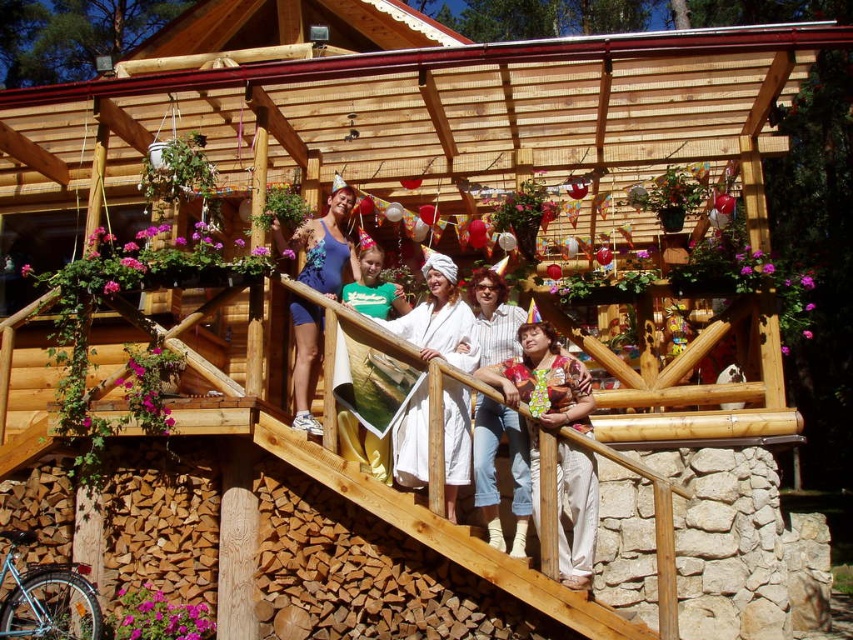
You are planning to hang a picture frame between the white cotton bathrobe at center and the blue fabric swimsuit at upper center. Which object should the frame be placed closer to if you want it to be at the same height as the taller object?

The blue fabric swimsuit at upper center is taller than the white cotton bathrobe at center. Therefore, to place the picture frame at the same height as the taller object, it should be positioned closer to the blue fabric swimsuit at upper center.

In the scene of a rustic cabin deck with people celebrating, there are two individuals wearing a white cotton bathrobe at center and a green cotton shirt at center. Which one is standing more to the right?

The white cotton bathrobe at center is positioned on the right side of green cotton shirt at center, so the white cotton bathrobe at center is standing more to the right.

In the scene described, there are a white cotton bathrobe at center and a blue fabric swimsuit at upper center. Which item is positioned to the right of the other?

The white cotton bathrobe at center is to the right of the blue fabric swimsuit at upper center.